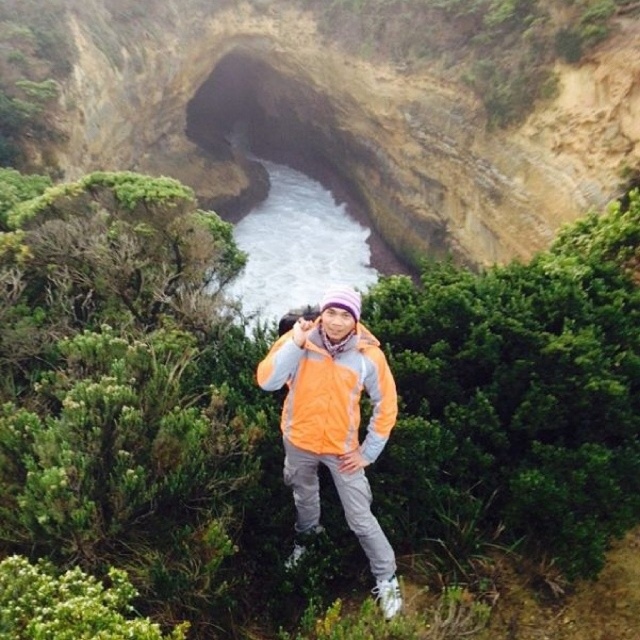
Is point (310, 234) in front of point (326, 436)?

No, (310, 234) is further to viewer.

I want to click on white frothy water at center, so point(292,237).

Where is `white frothy water at center`? white frothy water at center is located at coordinates (292, 237).

Is orange fabric jacket at center smaller than white frothy water at center?

Yes, orange fabric jacket at center is smaller than white frothy water at center.

Does orange fabric jacket at center lie behind white frothy water at center?

No.

Which is behind, point (300, 336) or point (294, 212)?

Positioned behind is point (294, 212).

Locate an element on the screen. The height and width of the screenshot is (640, 640). orange fabric jacket at center is located at coordinates (336, 422).

Is point (266, 364) positioned behind point (356, 323)?

Yes, point (266, 364) is farther from viewer.

Which is above, orange fabric jacket at center or orange fleece jacket at center?

orange fleece jacket at center

Image resolution: width=640 pixels, height=640 pixels. Describe the element at coordinates (336, 422) in the screenshot. I see `orange fabric jacket at center` at that location.

I want to click on orange fabric jacket at center, so pyautogui.click(x=336, y=422).